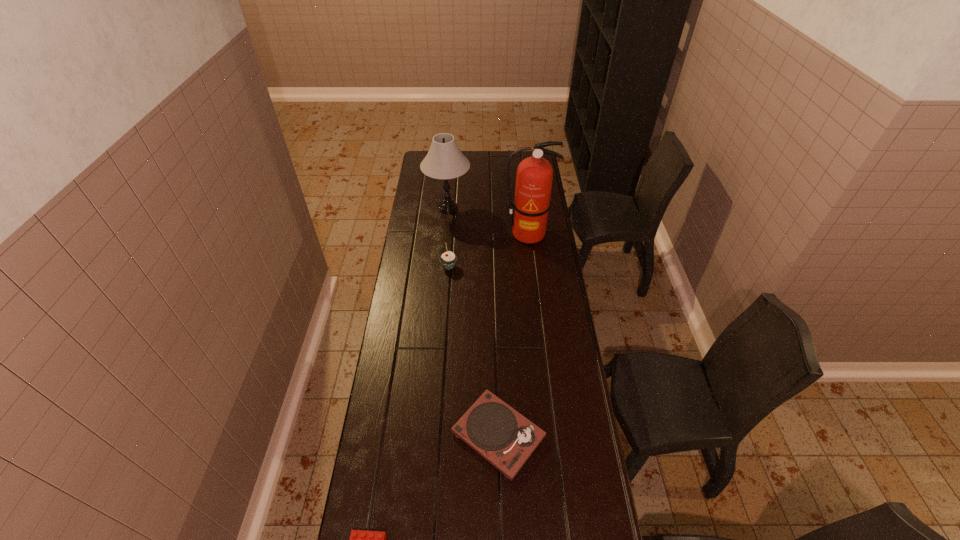
The width and height of the screenshot is (960, 540). What are the coordinates of `free region located on the back of the cupcake` in the screenshot? It's located at (453, 210).

Where is `free space located 0.080m on the front of the second nearest object`? The width and height of the screenshot is (960, 540). free space located 0.080m on the front of the second nearest object is located at coordinates (500, 510).

Image resolution: width=960 pixels, height=540 pixels. I want to click on object that is positioned at the left edge, so click(x=444, y=160).

You are a GUI agent. You are given a task and a screenshot of the screen. Output one action in this format:
    pyautogui.click(x=<x>, y=<y>)
    Task: Click on the fire extinguisher at the right edge
    This screenshot has height=540, width=960.
    Given the screenshot: What is the action you would take?
    pyautogui.click(x=534, y=176)

What are the coordinates of `phonograph_record at the right edge` in the screenshot? It's located at (505, 438).

I want to click on free space at the far edge, so click(x=473, y=159).

This screenshot has height=540, width=960. I want to click on free space at the left edge of the desktop, so click(384, 503).

Image resolution: width=960 pixels, height=540 pixels. Find the location of `vacant space at the right edge`. vacant space at the right edge is located at coordinates (552, 241).

Where is `vacant region at the far right corner of the desktop`? This screenshot has height=540, width=960. vacant region at the far right corner of the desktop is located at coordinates (519, 162).

Locate an element on the screen. unoccupied position between the third nearest object and the lamp is located at coordinates (448, 238).